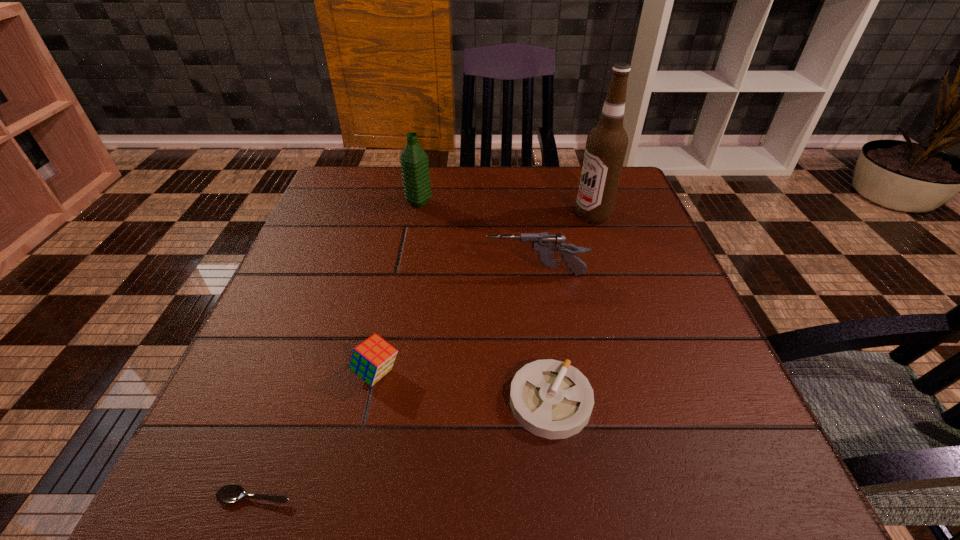
Locate an element on the screen. The image size is (960, 540). vacant space at the far left corner is located at coordinates (324, 198).

This screenshot has height=540, width=960. What are the coordinates of `vacant space at the far right corner of the desktop` in the screenshot? It's located at (577, 180).

Identify the location of unoccupied position between the rightmost object and the cube. (485, 294).

In order to click on vacant space that is in between the third farthest object and the cube in this screenshot , I will do `click(456, 323)`.

Locate an element on the screen. unoccupied area between the soupspoon and the water bottle is located at coordinates (337, 349).

At what (x,y) coordinates should I click in order to perform the action: click on vacant area that lies between the rightmost object and the water bottle. Please return your answer as a coordinate pair (x, y). Looking at the image, I should click on (506, 209).

Where is `free space between the leftmost object and the ashtray`? Image resolution: width=960 pixels, height=540 pixels. free space between the leftmost object and the ashtray is located at coordinates (402, 449).

This screenshot has width=960, height=540. Find the location of `free space between the third farthest object and the fourth tallest object`. free space between the third farthest object and the fourth tallest object is located at coordinates (456, 323).

You are a GUI agent. You are given a task and a screenshot of the screen. Output one action in this format:
    pyautogui.click(x=<x>, y=<y>)
    Task: Click on the vacant area that lies between the ashtray and the cube
    The width and height of the screenshot is (960, 540).
    Given the screenshot: What is the action you would take?
    pyautogui.click(x=464, y=387)

This screenshot has height=540, width=960. Identify the location of free space between the shortest object and the second tallest object. (337, 349).